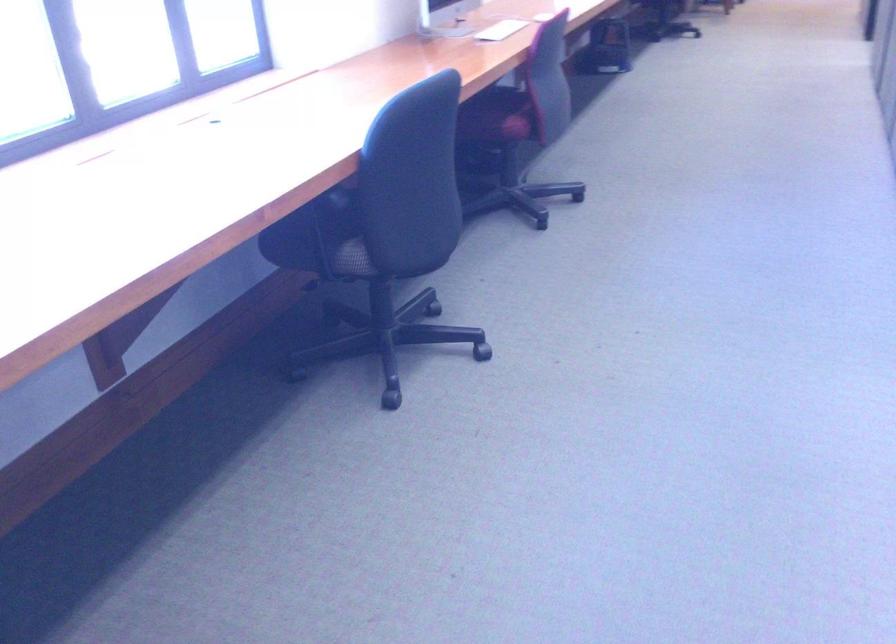
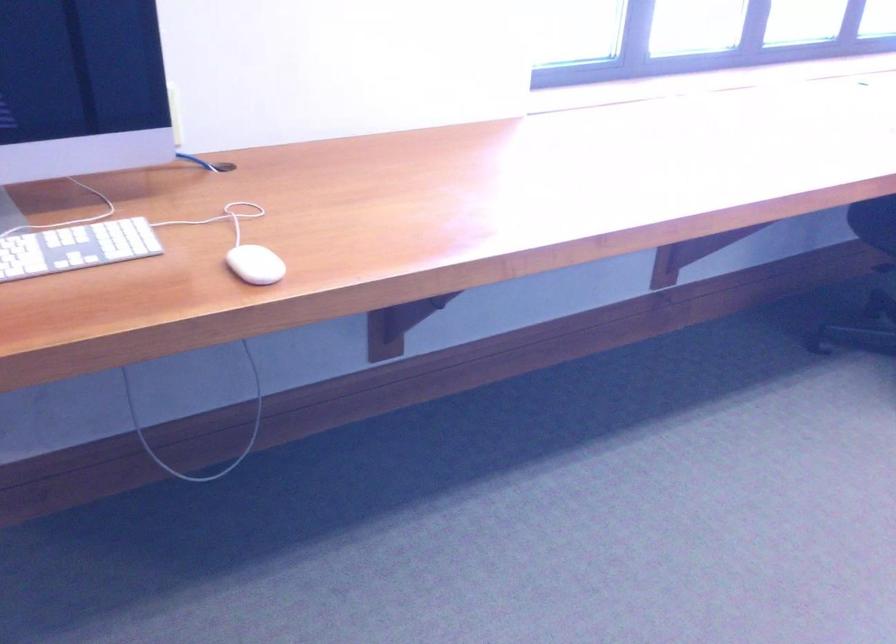
Question: The camera is either moving clockwise (left) or counter-clockwise (right) around the object. The first image is from the beginning of the video and the second image is from the end. Is the camera moving left or right when shooting the video?

Choices:
 (A) Left
 (B) Right

Answer: (B)